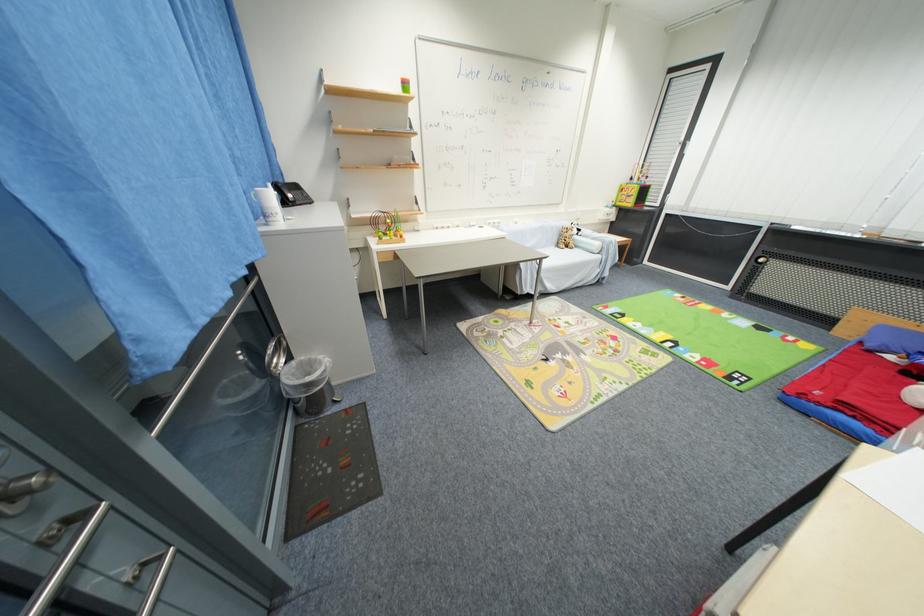
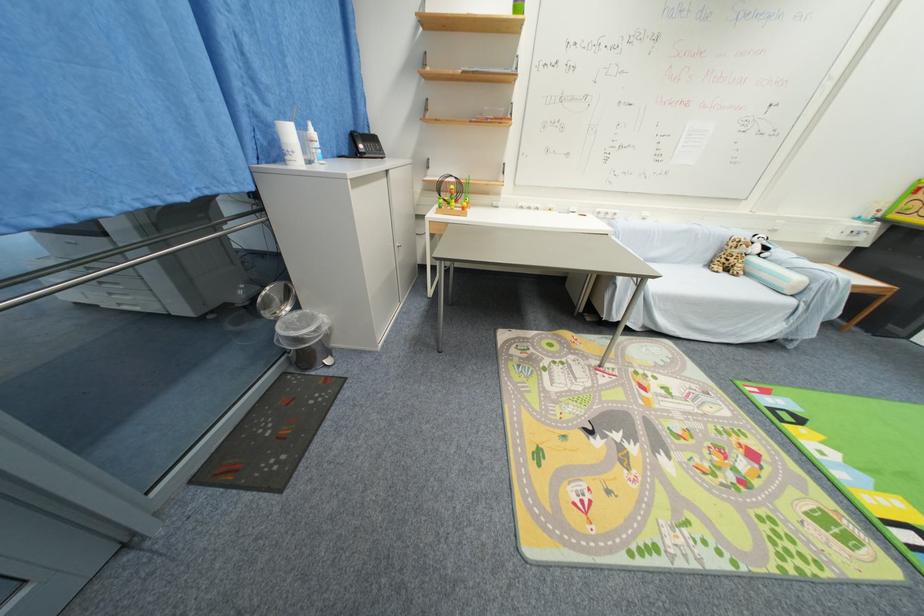
Where in the second image is the point corresponding to point 580,233 from the first image?

(761, 251)